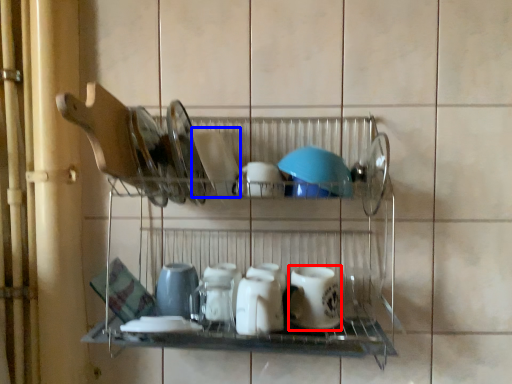
Question: Among these objects, which one is farthest to the camera, tableware (highlighted by a red box) or tableware (highlighted by a blue box)?

Choices:
 (A) tableware
 (B) tableware

Answer: (A)